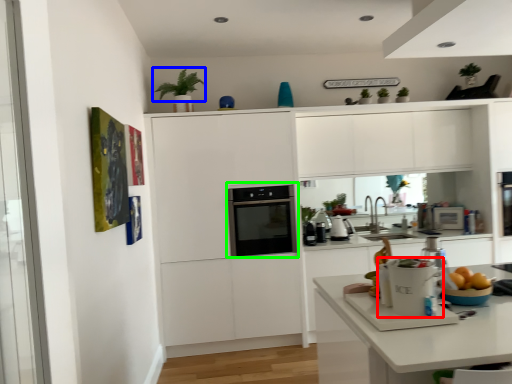
Question: Which object is the closest to the kitchen appliance (highlighted by a red box)? Choose among these: plant (highlighted by a blue box) or home appliance (highlighted by a green box).

Choices:
 (A) plant
 (B) home appliance

Answer: (B)